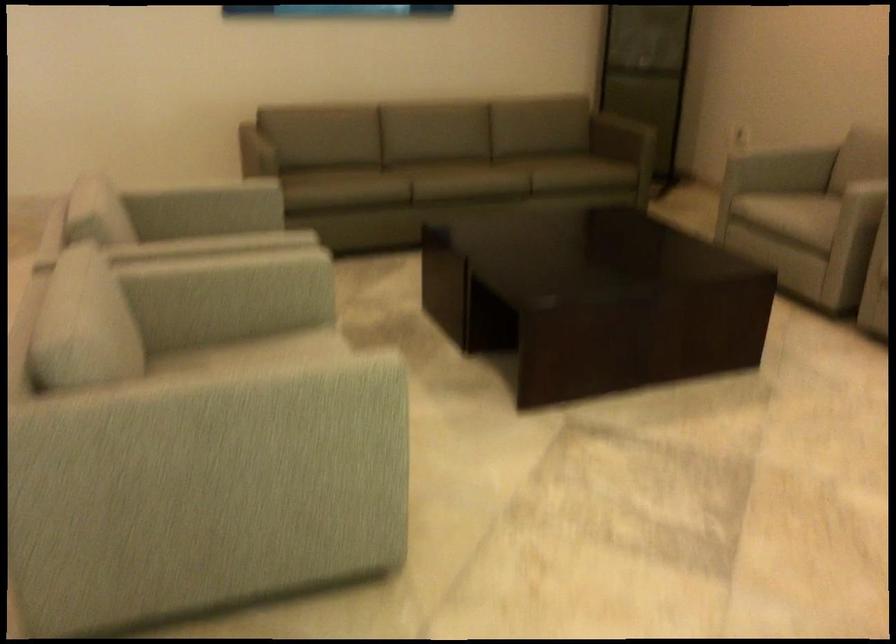
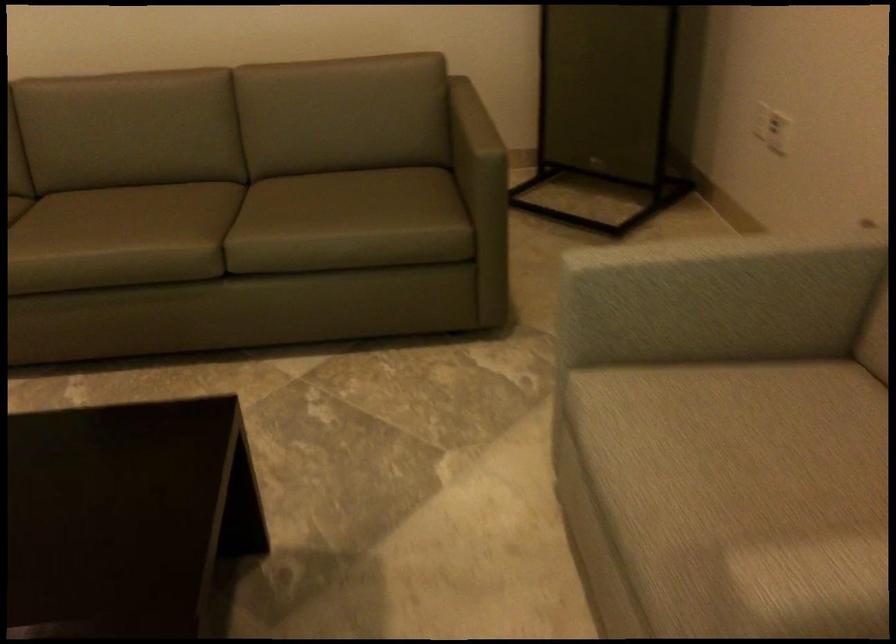
What movement of the cameraman would produce the second image?

The movement direction of the cameraman is right, forward.